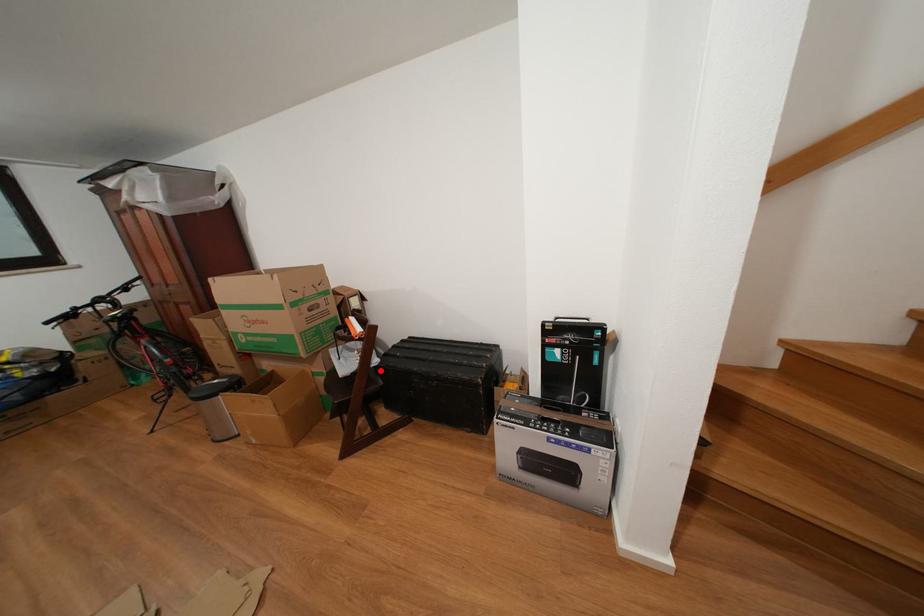
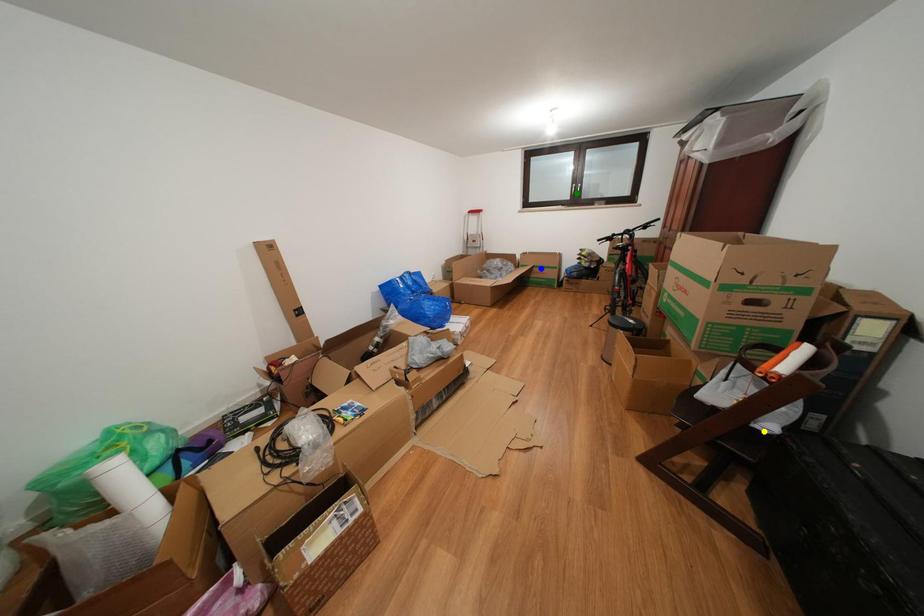
Question: I am providing you with two images of the same scene from different viewpoints. A red point is marked on the first image. You are given multiple points on the second image. In image 2, which mark is for the same physical point as the one in image 1?

Choices:
 (A) yellow point
 (B) green point
 (C) blue point

Answer: (A)